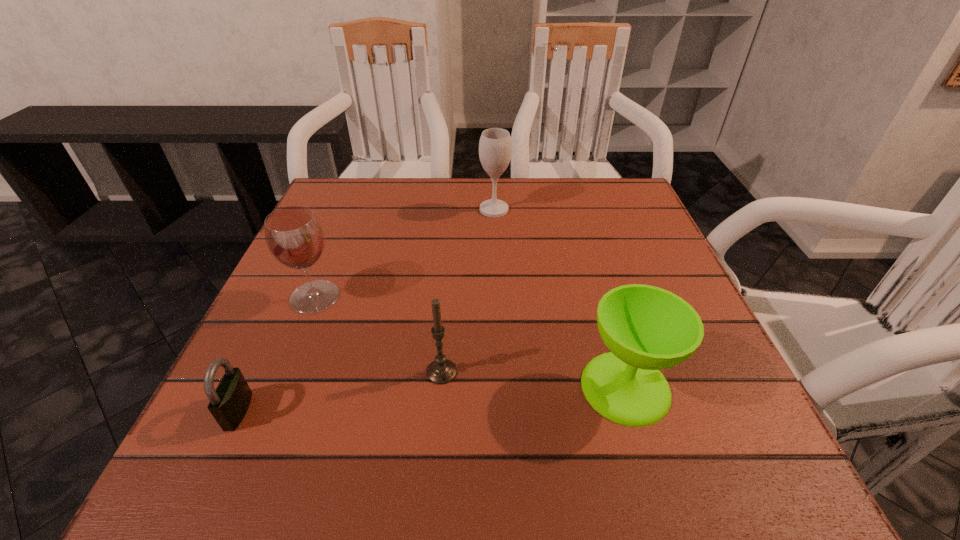
Identify the location of free space that satisfies the following two spatial constraints: 1. on the front side of the candle; 2. on the right side of the rightmost object. The width and height of the screenshot is (960, 540). (441, 387).